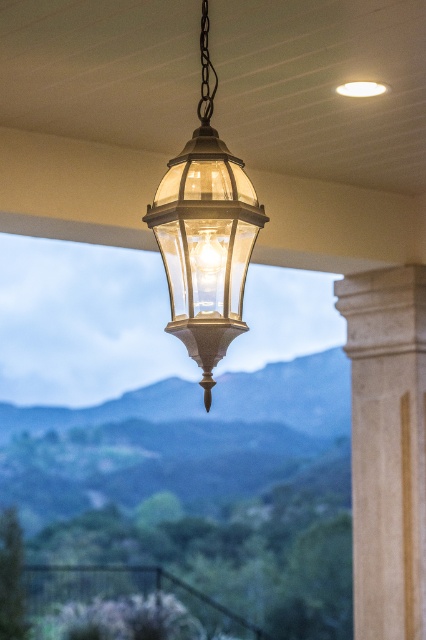
Question: Among these objects, which one is nearest to the camera?

Choices:
 (A) matte glass lantern at center
 (B) white marble column at right
 (C) green textured mountains at center
 (D) translucent glass lantern at center

Answer: (A)

Question: Does matte glass lantern at center appear under translucent glass lantern at center?

Choices:
 (A) yes
 (B) no

Answer: (B)

Question: Can you confirm if green textured mountains at center is positioned below translucent glass lantern at center?

Choices:
 (A) yes
 (B) no

Answer: (A)

Question: Among these objects, which one is farthest from the camera?

Choices:
 (A) translucent glass lantern at center
 (B) green textured mountains at center

Answer: (B)

Question: Among these objects, which one is nearest to the camera?

Choices:
 (A) green textured mountains at center
 (B) translucent glass lantern at center

Answer: (B)

Question: Can you confirm if green textured mountains at center is wider than matte glass lantern at center?

Choices:
 (A) yes
 (B) no

Answer: (A)